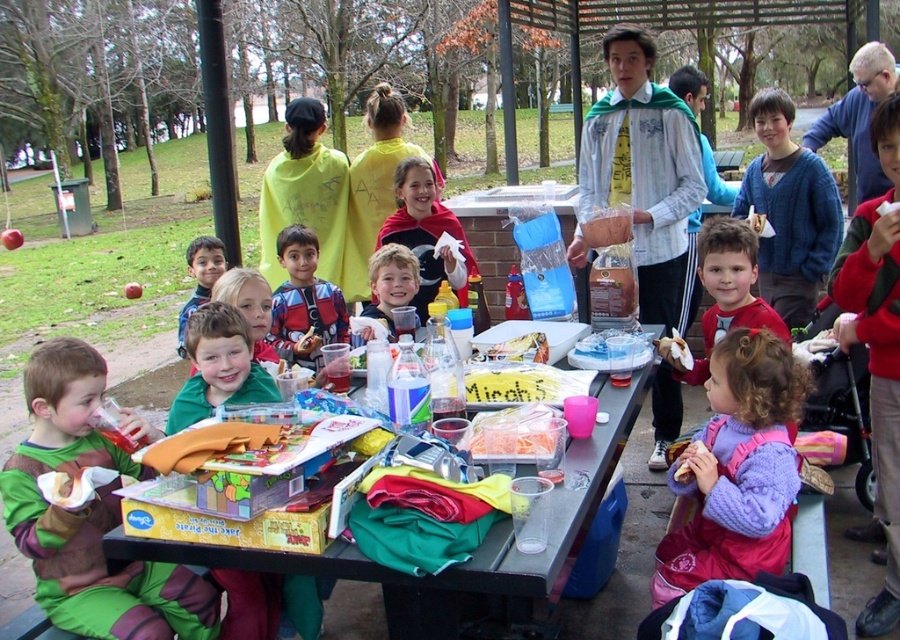
Question: Which of the following is the farthest from the observer?

Choices:
 (A) (668, 157)
 (B) (208, 266)

Answer: (B)

Question: Observing the image, what is the correct spatial positioning of yellow fabric cape at upper center in reference to smooth brown hair at center?

Choices:
 (A) left
 (B) right

Answer: (A)

Question: Which object is closer to the camera taking this photo?

Choices:
 (A) green jersey at lower left
 (B) green fabric costume at lower left
 (C) yellow fabric cape at upper center

Answer: (B)

Question: Which of the following is the closest to the observer?

Choices:
 (A) yellow fabric cape at upper center
 (B) translucent plastic bag at center
 (C) smooth green shirt at center

Answer: (B)

Question: Is yellow fabric cape at upper center wider than green jersey at lower left?

Choices:
 (A) no
 (B) yes

Answer: (B)

Question: From the image, what is the correct spatial relationship of green fabric costume at lower left in relation to purple fleece sweater at lower right?

Choices:
 (A) left
 (B) right

Answer: (A)